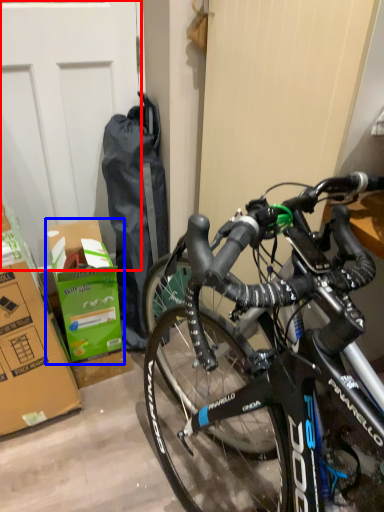
Question: Which object appears closest to the camera in this image, garage door (highlighted by a red box) or cardboard box (highlighted by a blue box)?

Choices:
 (A) garage door
 (B) cardboard box

Answer: (A)